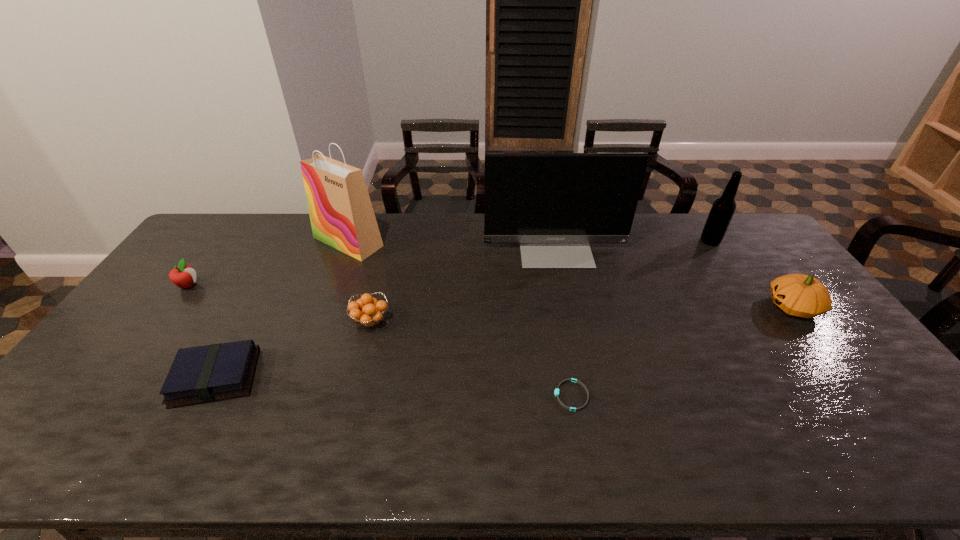
Find the location of a particular element. The image size is (960, 540). vacant area situated on the right of the shopping bag is located at coordinates (423, 241).

The height and width of the screenshot is (540, 960). What are the coordinates of `free space located 0.390m on the screen of the computer monitor` in the screenshot? It's located at (579, 362).

Where is `vacant area located 0.330m on the left of the sixth shortest object`? vacant area located 0.330m on the left of the sixth shortest object is located at coordinates (609, 241).

Image resolution: width=960 pixels, height=540 pixels. What are the coordinates of `free space located on the side of the gourd with the carved face` in the screenshot? It's located at (737, 307).

You are a GUI agent. You are given a task and a screenshot of the screen. Output one action in this format:
    pyautogui.click(x=<x>, y=<y>)
    Task: Click on the vacant area situated 0.120m on the side of the gourd with the carved face
    
    Given the screenshot: What is the action you would take?
    [x=728, y=307]

This screenshot has height=540, width=960. What are the coordinates of `free spot located 0.230m on the side of the gourd with the carved face` in the screenshot? It's located at [691, 307].

At what (x,y) coordinates should I click in order to perform the action: click on vacant space located on the right of the leftmost object. Please return your answer as a coordinate pair (x, y). Looking at the image, I should click on click(225, 285).

I want to click on vacant position located 0.150m on the back of the orange fruit, so [x=382, y=275].

This screenshot has height=540, width=960. In order to click on free location located on the back of the second shortest object in this screenshot , I will do `click(273, 274)`.

Locate an element on the screen. This screenshot has width=960, height=540. free space located 0.140m on the buckle of the shortest object is located at coordinates (498, 396).